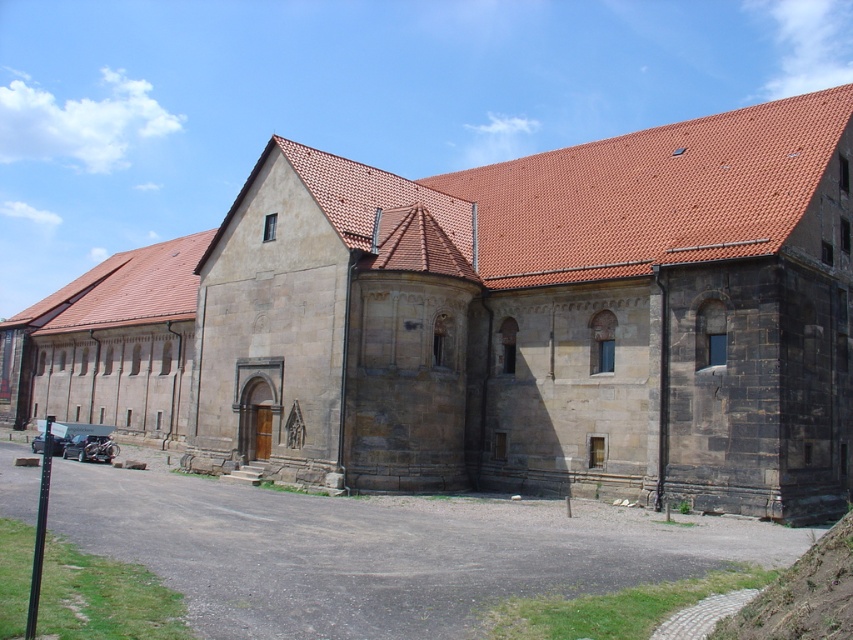
You are standing at the base of the green grassy hill at lower right and want to reach the stone chapel at center. Which direction should you walk to get there?

You should walk upwards towards the stone chapel at center since it is located above the green grassy hill at lower right.

You are standing at the base of the green grassy hill at lower right and want to walk towards the stone chapel at center. In which direction should you head?

You should head to the left side to reach the stone chapel at center since it is positioned on the left side of the green grassy hill at lower right.